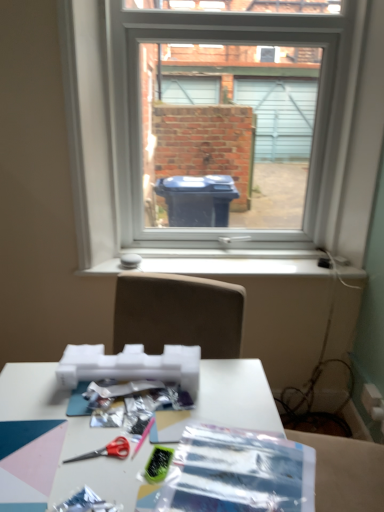
Question: Considering the relative sizes of white plastic window sill at center and translucent plastic wrapping paper at center in the image provided, is white plastic window sill at center taller than translucent plastic wrapping paper at center?

Choices:
 (A) no
 (B) yes

Answer: (B)

Question: Can you confirm if white plastic window sill at center is positioned to the right of translucent plastic wrapping paper at center?

Choices:
 (A) no
 (B) yes

Answer: (B)

Question: Considering the relative sizes of white plastic window sill at center and translucent plastic wrapping paper at center in the image provided, is white plastic window sill at center shorter than translucent plastic wrapping paper at center?

Choices:
 (A) no
 (B) yes

Answer: (A)

Question: Is white plastic window sill at center next to translucent plastic wrapping paper at center?

Choices:
 (A) yes
 (B) no

Answer: (B)

Question: From a real-world perspective, does white plastic window sill at center stand above translucent plastic wrapping paper at center?

Choices:
 (A) yes
 (B) no

Answer: (A)

Question: Considering the relative sizes of white plastic window sill at center and translucent plastic wrapping paper at center in the image provided, is white plastic window sill at center wider than translucent plastic wrapping paper at center?

Choices:
 (A) no
 (B) yes

Answer: (A)

Question: Is red plastic scissors at lower center looking in the opposite direction of white plastic window sill at center?

Choices:
 (A) yes
 (B) no

Answer: (B)

Question: Is red plastic scissors at lower center at the right side of white plastic window sill at center?

Choices:
 (A) no
 (B) yes

Answer: (A)

Question: Considering the relative sizes of red plastic scissors at lower center and white plastic window sill at center in the image provided, is red plastic scissors at lower center taller than white plastic window sill at center?

Choices:
 (A) no
 (B) yes

Answer: (A)

Question: Does red plastic scissors at lower center have a lesser height compared to white plastic window sill at center?

Choices:
 (A) yes
 (B) no

Answer: (A)

Question: Is red plastic scissors at lower center smaller than white plastic window sill at center?

Choices:
 (A) no
 (B) yes

Answer: (B)

Question: Is red plastic scissors at lower center thinner than white plastic window sill at center?

Choices:
 (A) yes
 (B) no

Answer: (A)

Question: Considering the relative sizes of white matte table at lower center and white plastic window at center in the image provided, is white matte table at lower center wider than white plastic window at center?

Choices:
 (A) yes
 (B) no

Answer: (A)